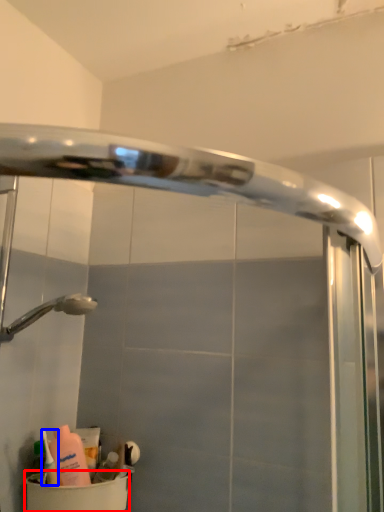
Question: Which of the following is the closest to the observer, toilet bowl (highlighted by a red box) or cleaning product (highlighted by a blue box)?

Choices:
 (A) toilet bowl
 (B) cleaning product

Answer: (A)